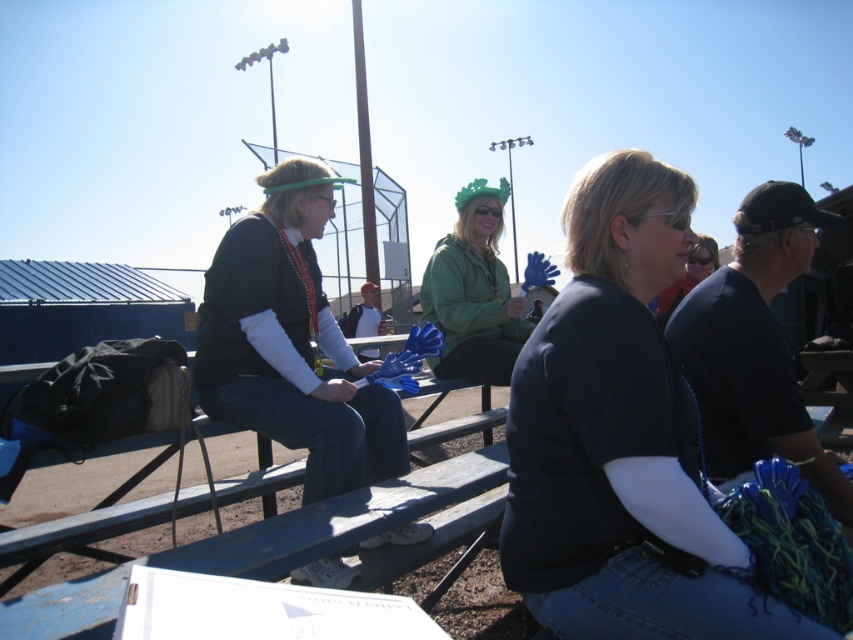
You are a photographer trying to capture a candid shot of the dark blue jersey at center and the matte black jacket at left. Since you want to ensure both subjects are in focus, you need to know which one is closer to the camera. Can you determine which is closer based on their sizes?

The dark blue jersey at center is thinner than the matte black jacket at left, so the dark blue jersey at center is closer to the camera.

You are standing at the point labeled as point (337, 461) in the image. You want to throw a baseball to a friend who is standing 2.32 meters away from you. Can you reach your friend with a single throw?

Yes, because the distance between you and your friend is exactly 2.32 meters, which is within a typical throwing range for a baseball.